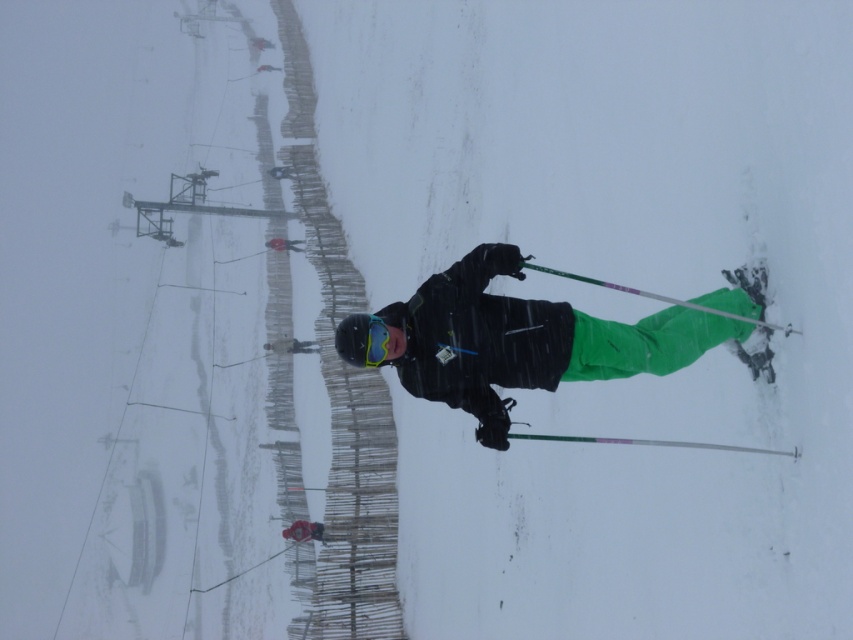
You are a photographer trying to capture the skier in the snowy scene. You notice two items on the skier, the matte blue goggles at center and the matte black helmet at center. Which of these items appears smaller in the photo?

The matte blue goggles at center appears smaller than the matte black helmet at center in the photo.

You are a photographer trying to capture a clear shot of the matte black snowboarder at center and the matte black helmet at center. If your camera has a fixed focus that can only capture objects wider than a certain threshold, which object would you prioritize focusing on to ensure it is in focus?

The matte black snowboarder at center might be wider than the matte black helmet at center, so you should prioritize focusing on the matte black snowboarder at center to ensure it is in focus.

You are a photographer trying to capture a clear shot of the matte black snowboarder at center and the matte blue goggles at center. Which object should you focus on first to ensure both are in the frame?

The matte black snowboarder at center is positioned over the matte blue goggles at center, so focusing on the snowboarder first will ensure the goggles are also in the frame.